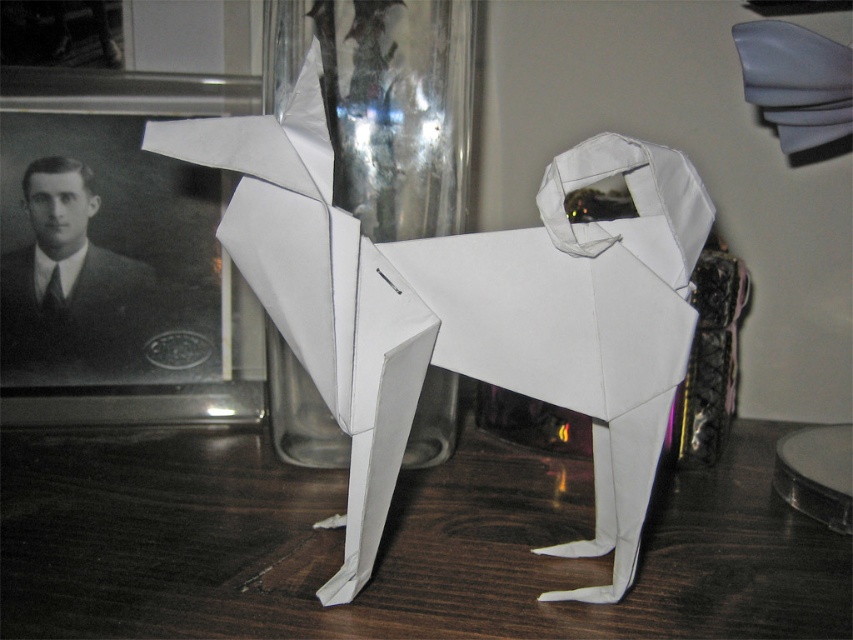
Question: Does wooden table at center come behind transparent glass at center?

Choices:
 (A) no
 (B) yes

Answer: (A)

Question: Does wooden table at center appear on the right side of transparent glass at center?

Choices:
 (A) yes
 (B) no

Answer: (A)

Question: Can you confirm if wooden table at center is wider than transparent glass at center?

Choices:
 (A) yes
 (B) no

Answer: (A)

Question: Which object is farther from the camera taking this photo?

Choices:
 (A) transparent glass at center
 (B) wooden table at center

Answer: (A)

Question: Which point is closer to the camera taking this photo?

Choices:
 (A) (209, 608)
 (B) (372, 132)

Answer: (A)